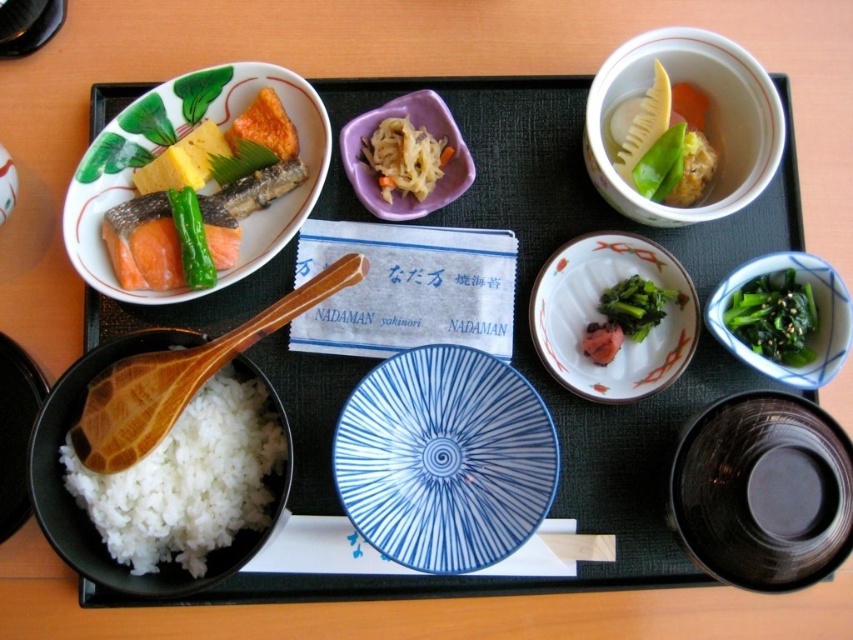
Between point (404, 529) and point (741, 52), which one is positioned behind?

Positioned behind is point (741, 52).

You are a GUI agent. You are given a task and a screenshot of the screen. Output one action in this format:
    pyautogui.click(x=<x>, y=<y>)
    Task: Click on the blue and white ceramic bowl at center
    Image resolution: width=853 pixels, height=640 pixels.
    Given the screenshot: What is the action you would take?
    pyautogui.click(x=444, y=460)

Does point (494, 520) come farther from viewer compared to point (601, 115)?

No, (494, 520) is closer to viewer.

Find the location of a particular element. The image size is (853, 640). blue and white ceramic bowl at center is located at coordinates (444, 460).

Who is shorter, porcelain bowl with floral design at upper right or wooden spoon at lower left?

Standing shorter between the two is wooden spoon at lower left.

Is porcelain bowl with floral design at upper right positioned in front of wooden spoon at lower left?

No, it is not.

Which is behind, point (730, 77) or point (219, 362)?

The point (730, 77) is more distant.

Where is `porcelain bowl with floral design at upper right`? Image resolution: width=853 pixels, height=640 pixels. porcelain bowl with floral design at upper right is located at coordinates (711, 120).

Who is more distant from viewer, (515, 536) or (741, 497)?

The point (515, 536) is more distant.

Does blue and white ceramic bowl at center lie in front of black glossy bowl at lower right?

No, blue and white ceramic bowl at center is behind black glossy bowl at lower right.

Where is `blue and white ceramic bowl at center`? blue and white ceramic bowl at center is located at coordinates (444, 460).